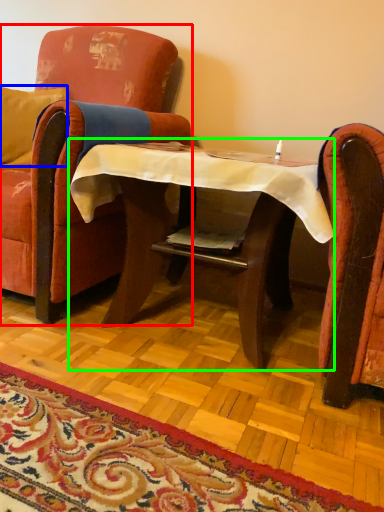
Question: Which object is positioned farthest from chair (highlighted by a red box)? Select from pillow (highlighted by a blue box) and table (highlighted by a green box).

Choices:
 (A) pillow
 (B) table

Answer: (A)